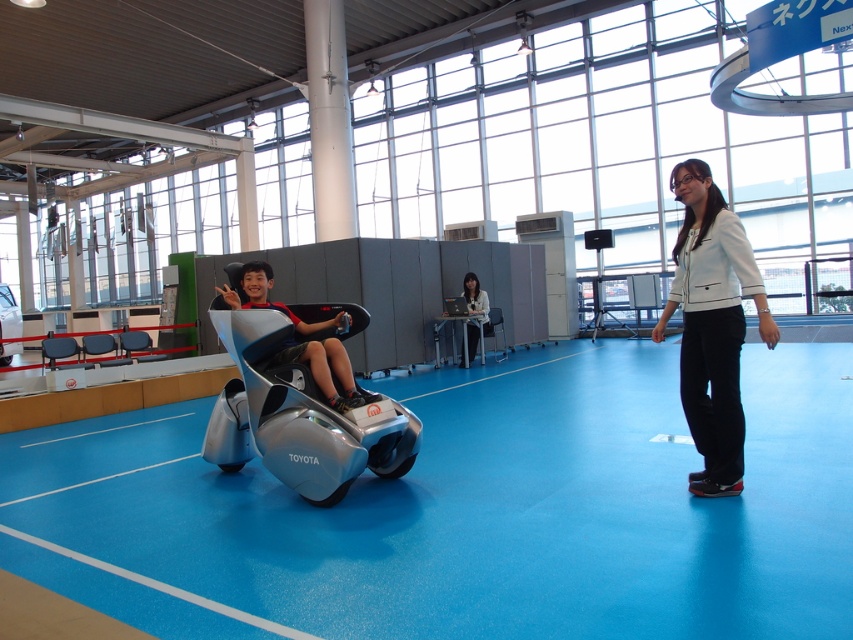
You are a delivery robot that needs to navigate through this futuristic space. You see a silver metallic mobility scooter at center and a silver metallic car at center. Which one takes up more space in the middle of the room?

The silver metallic mobility scooter at center is bigger than the silver metallic car at center, so it takes up more space in the middle of the room.

You are a photographer planning to take a photo of the silver metallic car at center. You want to ensure the white matte jacket at center is visible but not too prominent in the shot. Given their sizes, can you frame the shot so the jacket is partially visible without overshadowing the car?

The white matte jacket at center has a lesser width compared to the silver metallic car at center, so yes, you can frame the shot so the jacket is partially visible without overshadowing the car since it is narrower.

You are standing in the futuristic space and want to move from the point closer to you to the point further away. Which path would you take between the point at coordinates point (x=683, y=378) and point (x=318, y=324)?

The path from point (x=683, y=378) to point (x=318, y=324) is the correct route since point (x=683, y=378) is closer to the viewer and point (x=318, y=324) is further away.